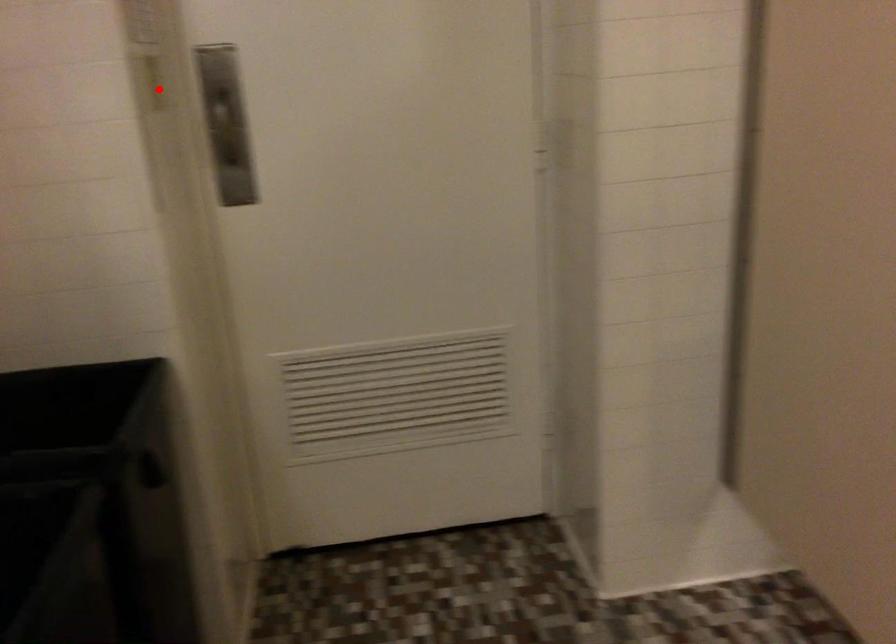
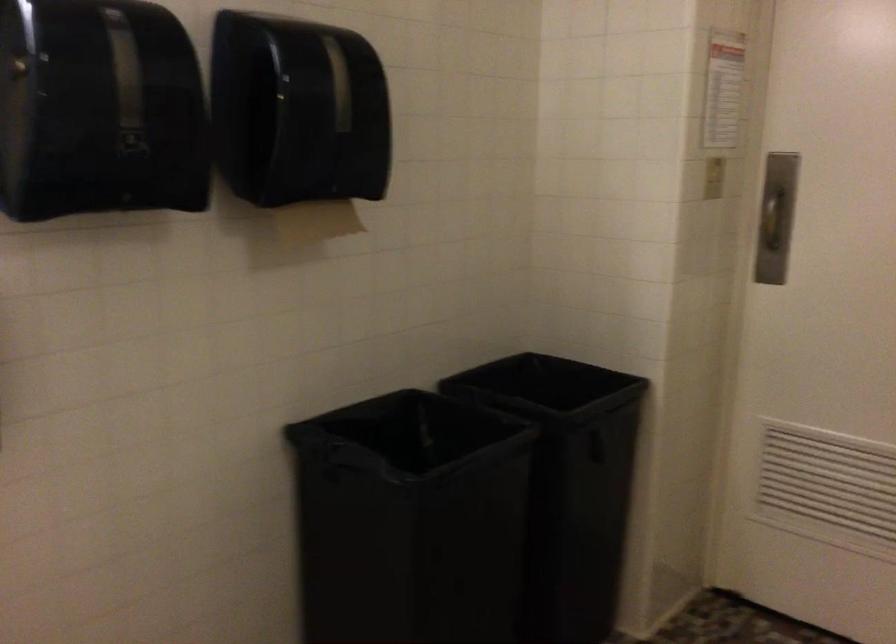
The point at the highlighted location is marked in the first image. Where is the corresponding point in the second image?

(713, 178)